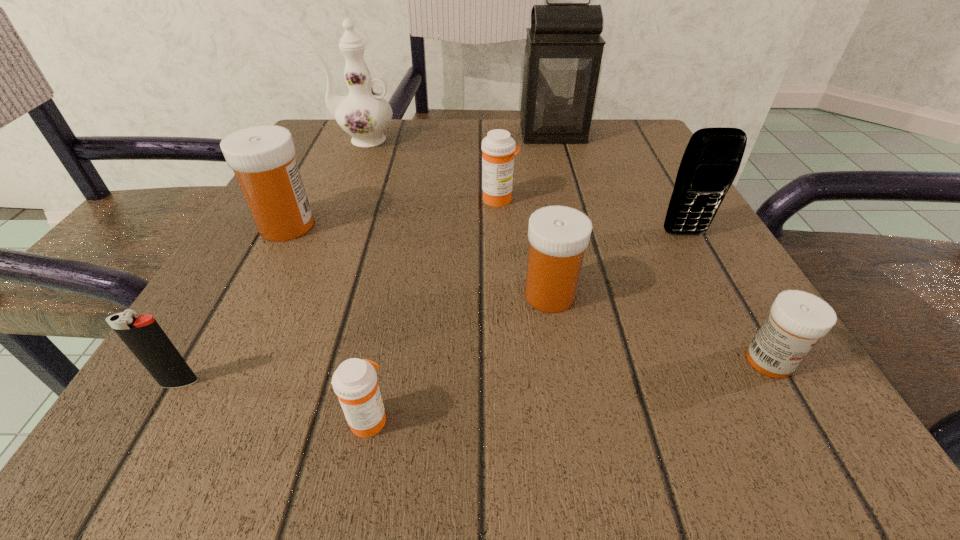
This screenshot has height=540, width=960. In order to click on free location at the far left corner of the desktop in this screenshot , I will do `click(344, 151)`.

In the image, there is a desktop. At what (x,y) coordinates should I click in order to perform the action: click on free space at the far right corner. Please return your answer as a coordinate pair (x, y). Looking at the image, I should click on (593, 152).

Locate an element on the screen. vacant space at the near right corner of the desktop is located at coordinates (763, 441).

The height and width of the screenshot is (540, 960). What are the coordinates of `free area in between the right orange medicine and the cellular telephone` in the screenshot? It's located at (591, 216).

Locate an element on the screen. The image size is (960, 540). free spot between the eighth shortest object and the cellular telephone is located at coordinates (523, 187).

Find the location of a particular element. The height and width of the screenshot is (540, 960). free spot between the cellular telephone and the second smallest white medicine is located at coordinates (617, 264).

Identify the location of empty space that is in between the left orange medicine and the second white medicine from right to left. (459, 356).

Identify the location of vacant region between the eighth shortest object and the third farthest medicine. (456, 217).

You are a GUI agent. You are given a task and a screenshot of the screen. Output one action in this format:
    pyautogui.click(x=<x>, y=<y>)
    Task: Click on the free space between the bigger orange medicine and the leftmost medicine
    
    Given the screenshot: What is the action you would take?
    pyautogui.click(x=393, y=212)

This screenshot has height=540, width=960. Find the location of `free space that is in between the tallest object and the farther orange medicine`. free space that is in between the tallest object and the farther orange medicine is located at coordinates (526, 166).